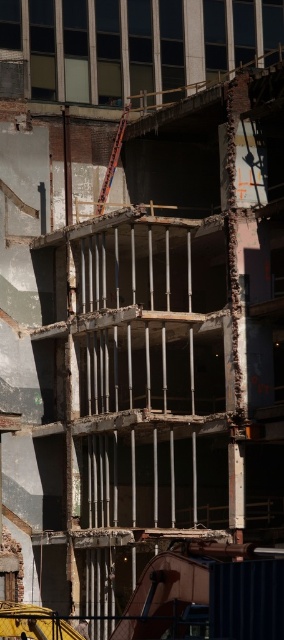
Question: Can you confirm if metallic helmet at center is smaller than yellow hard hat at center?

Choices:
 (A) no
 (B) yes

Answer: (A)

Question: Is rusty metal scaffolding at center positioned before yellow hard hat at center?

Choices:
 (A) no
 (B) yes

Answer: (A)

Question: Which point is farther to the camera?

Choices:
 (A) (76, 246)
 (B) (88, 636)
 (C) (30, 637)

Answer: (A)

Question: Among these points, which one is farthest from the camera?

Choices:
 (A) (28, 637)
 (B) (82, 632)

Answer: (B)

Question: Can you confirm if rusty metal scaffolding at center is wider than yellow hard hat at center?

Choices:
 (A) no
 (B) yes

Answer: (B)

Question: Among these objects, which one is farthest from the camera?

Choices:
 (A) metallic helmet at center
 (B) rusty metal scaffolding at center
 (C) yellow hard hat at center

Answer: (A)